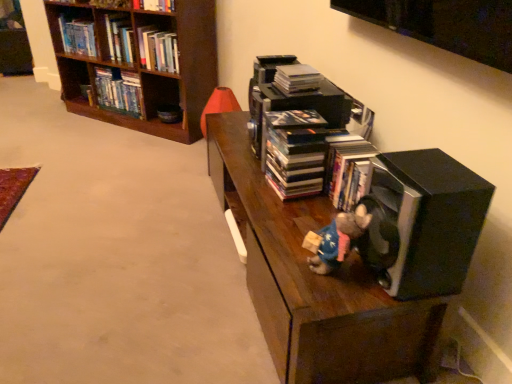
This screenshot has height=384, width=512. Find the location of `free space in front of black matte book at center, the first book from the front`. free space in front of black matte book at center, the first book from the front is located at coordinates (293, 211).